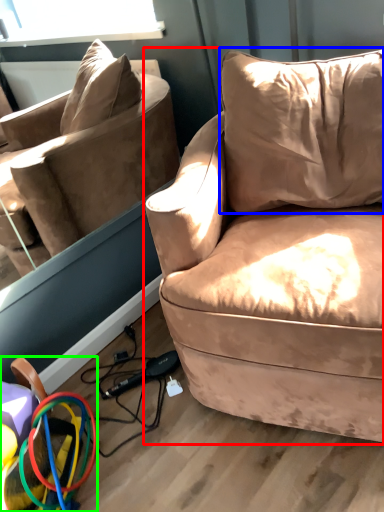
Question: Estimate the real-world distances between objects in this image. Which object is closer to studio couch (highlighted by a red box), pillow (highlighted by a blue box) or toy (highlighted by a green box)?

Choices:
 (A) pillow
 (B) toy

Answer: (A)